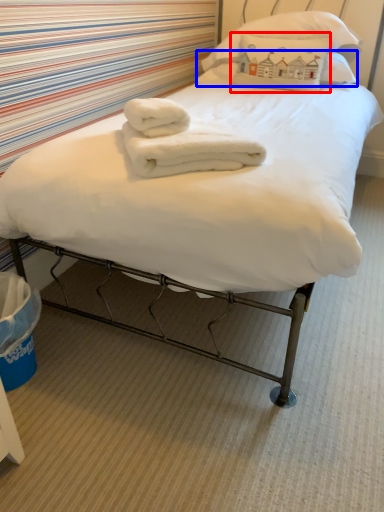
Question: Which object appears closest to the camera in this image, pillow (highlighted by a red box) or pillow (highlighted by a blue box)?

Choices:
 (A) pillow
 (B) pillow

Answer: (A)